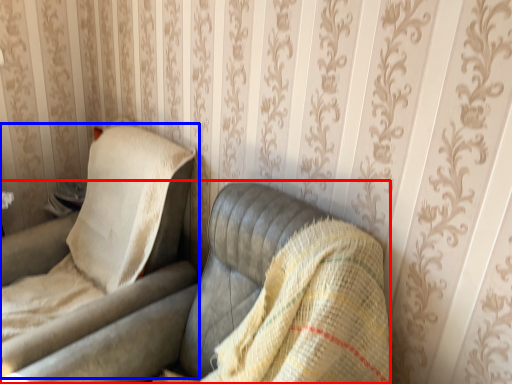
Question: Among these objects, which one is nearest to the camera, studio couch (highlighted by a red box) or chair (highlighted by a blue box)?

Choices:
 (A) studio couch
 (B) chair

Answer: (A)